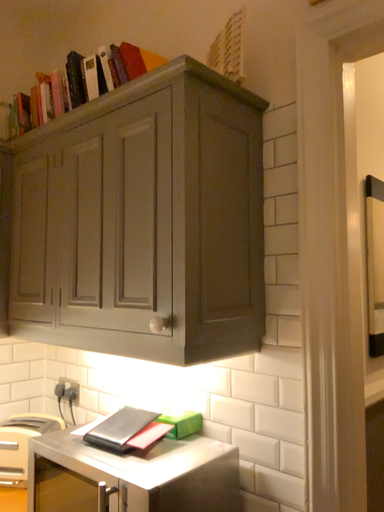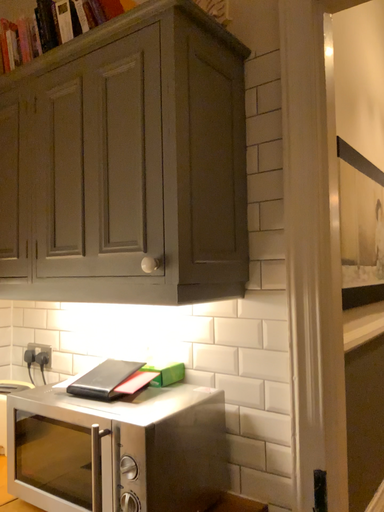
Question: How did the camera likely rotate when shooting the video?

Choices:
 (A) rotated left
 (B) rotated right

Answer: (B)